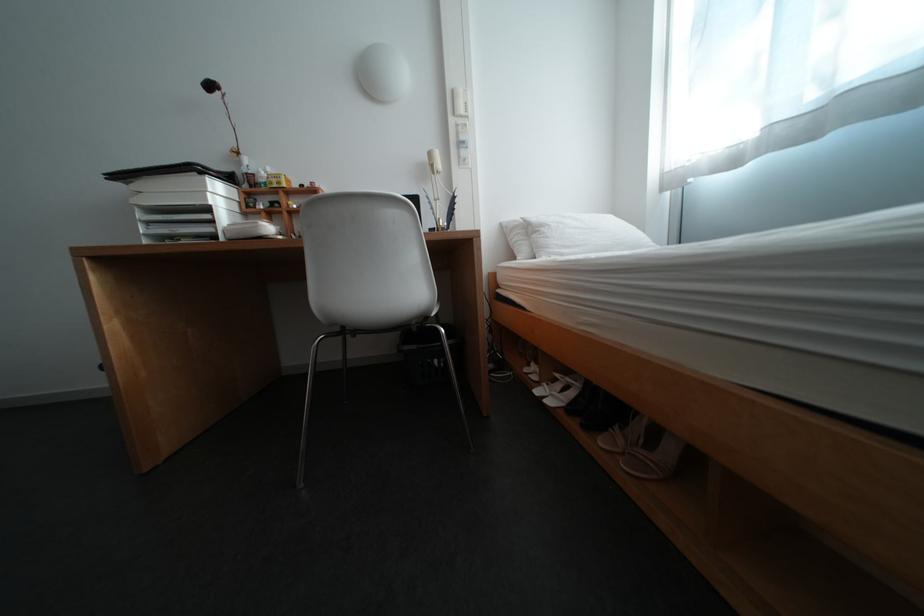
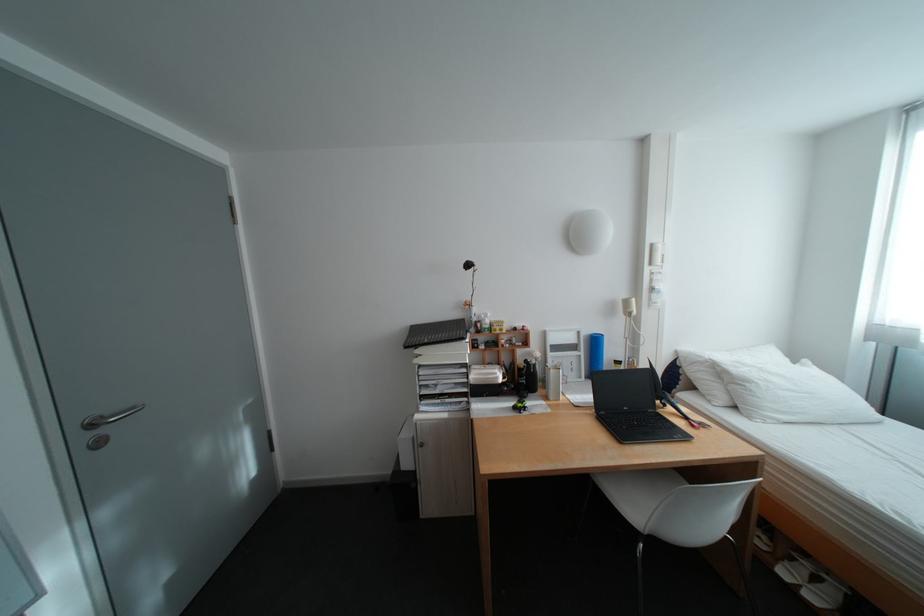
Find the pixel in the second image that matches the point at 224,207 in the first image.

(480, 363)